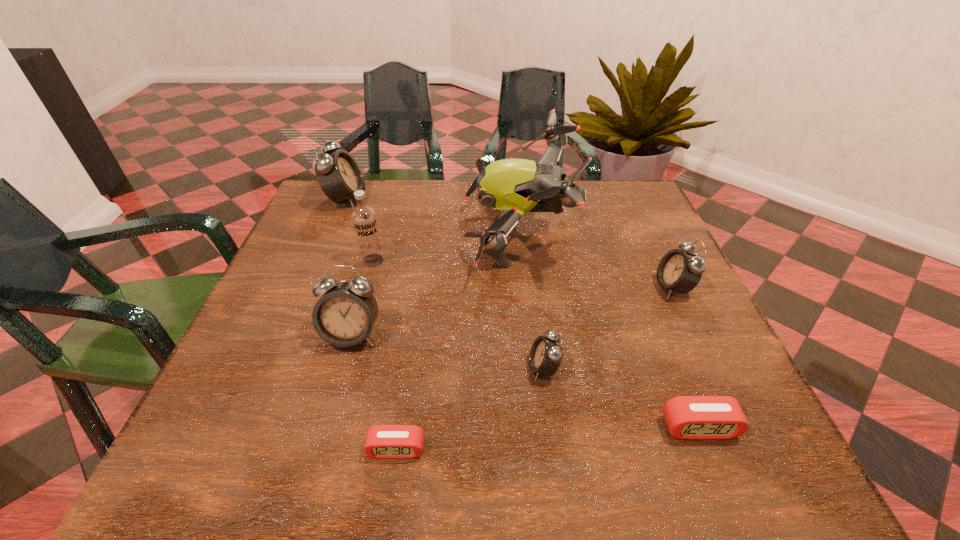
Find the location of `object situated at the far left corner`. object situated at the far left corner is located at coordinates (338, 174).

Locate an element on the screen. The height and width of the screenshot is (540, 960). object located at the near right corner is located at coordinates (687, 417).

This screenshot has height=540, width=960. Find the location of `free space at the far edge`. free space at the far edge is located at coordinates (471, 199).

In the image, there is a desktop. Where is `blank space at the left edge`? blank space at the left edge is located at coordinates (319, 244).

At what (x,y) coordinates should I click in order to perform the action: click on vacant region at the right edge of the desktop. Please return your answer as a coordinate pair (x, y). This screenshot has height=540, width=960. Looking at the image, I should click on (660, 379).

You are a GUI agent. You are given a task and a screenshot of the screen. Output one action in this format:
    pyautogui.click(x=<x>, y=<y>)
    Task: Click on the vacant space at the far left corner
    This screenshot has width=960, height=540.
    Given the screenshot: What is the action you would take?
    point(371,186)

In the image, there is a desktop. Where is `vacant space at the near right corner`? vacant space at the near right corner is located at coordinates click(771, 467).

This screenshot has height=540, width=960. What are the coordinates of `blank region between the third shortest alarm clock and the leftmost object` in the screenshot? It's located at (444, 284).

What are the coordinates of `vacant area that lies between the left pink alarm clock and the right pink alarm clock` in the screenshot? It's located at (547, 438).

The image size is (960, 540). What are the coordinates of `blank region between the vodka and the drone` in the screenshot? It's located at (445, 246).